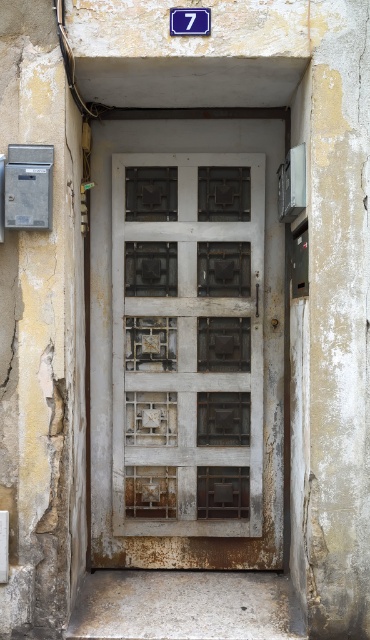
Question: Is white wooden door at center wider than blue plastic sign at upper center?

Choices:
 (A) yes
 (B) no

Answer: (A)

Question: Is white wooden door at center above blue plastic sign at upper center?

Choices:
 (A) yes
 (B) no

Answer: (B)

Question: Is white wooden door at center positioned at the back of blue plastic sign at upper center?

Choices:
 (A) no
 (B) yes

Answer: (B)

Question: Which point appears farthest from the camera in this image?

Choices:
 (A) (207, 8)
 (B) (250, 412)

Answer: (B)